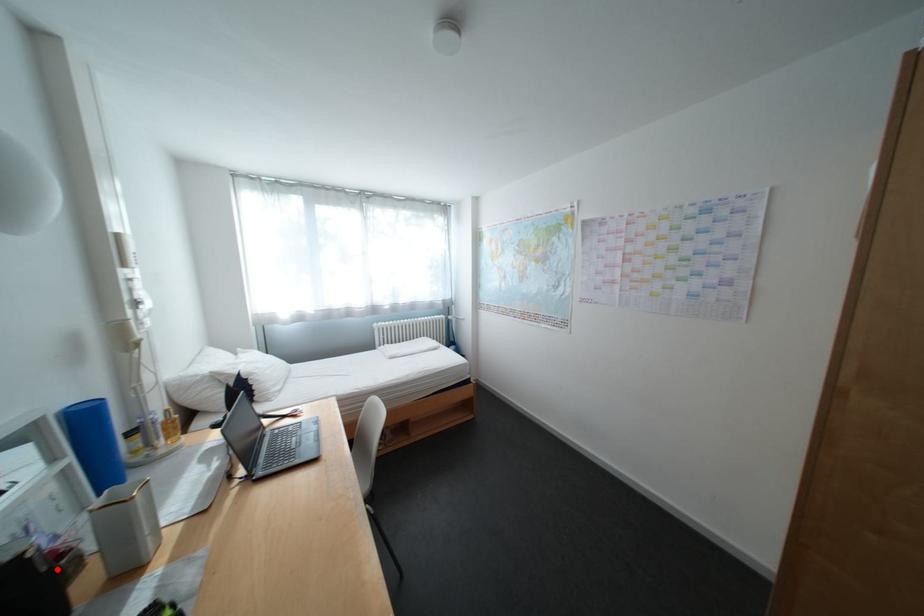
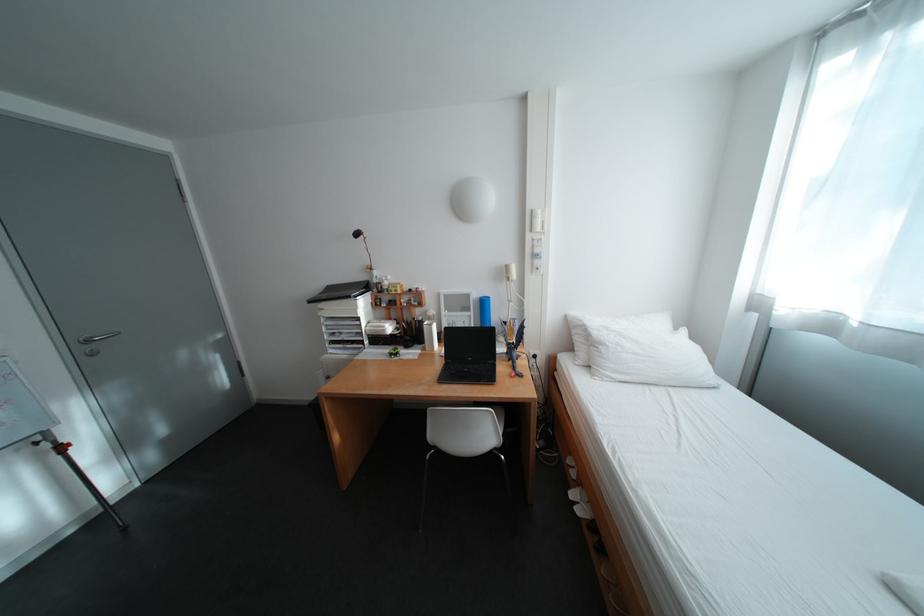
Question: I am providing you with two images of the same scene from different viewpoints. A red point is shown in image1. For the corresponding object point in image2, is it positioned nearer or farther from the camera?

Choices:
 (A) Nearer
 (B) Farther

Answer: (A)